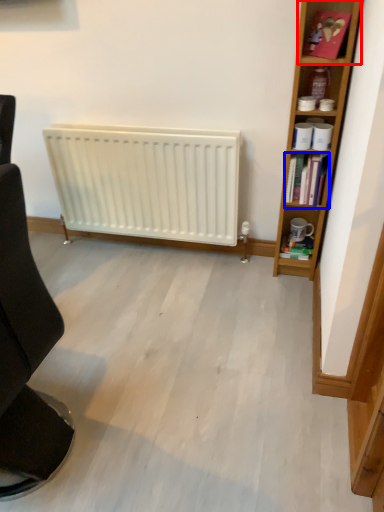
Question: Which of the following is the closest to the observer, cabinet (highlighted by a red box) or book (highlighted by a blue box)?

Choices:
 (A) cabinet
 (B) book

Answer: (A)